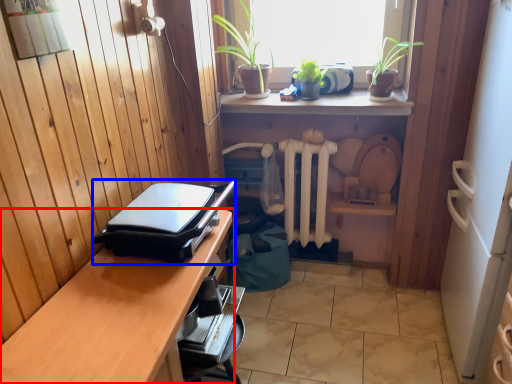
Question: Which point is further to the camera, desk (highlighted by a red box) or appliance (highlighted by a blue box)?

Choices:
 (A) desk
 (B) appliance

Answer: (B)